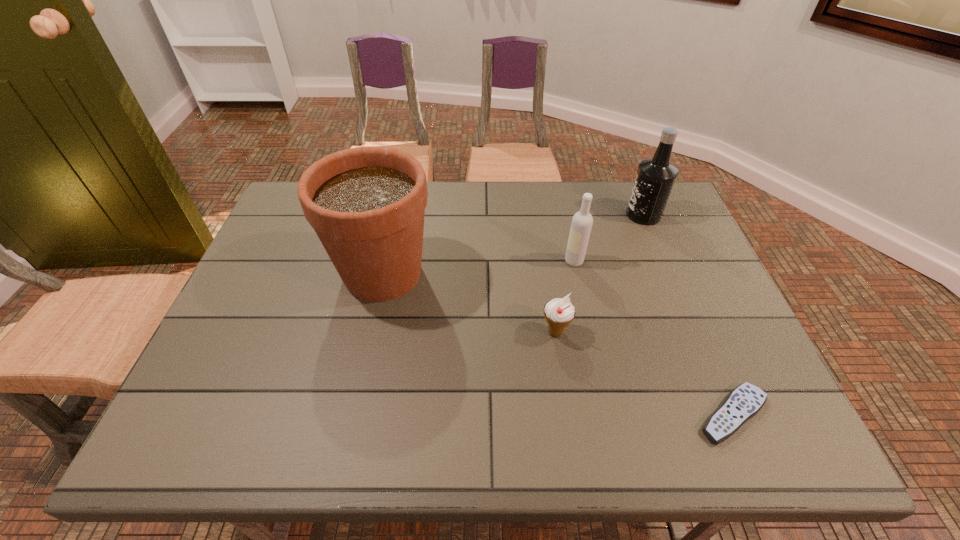
This screenshot has width=960, height=540. Find the location of `vacant point that satisfies the following two spatial constraints: 1. on the front label of the liquor; 2. on the front side of the leftmost object`. vacant point that satisfies the following two spatial constraints: 1. on the front label of the liquor; 2. on the front side of the leftmost object is located at coordinates (667, 273).

Identify the location of free location that satisfies the following two spatial constraints: 1. on the back side of the remote control; 2. on the front label of the farthest object. (648, 215).